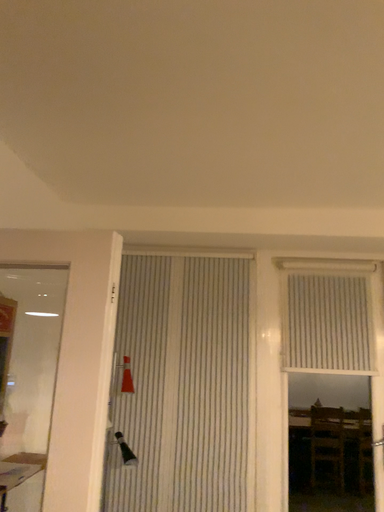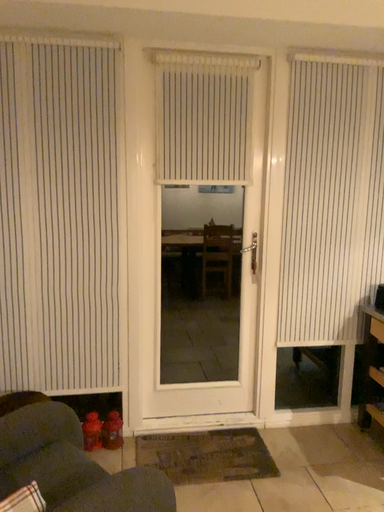
Question: Which way did the camera rotate in the video?

Choices:
 (A) rotated upward
 (B) rotated downward

Answer: (B)